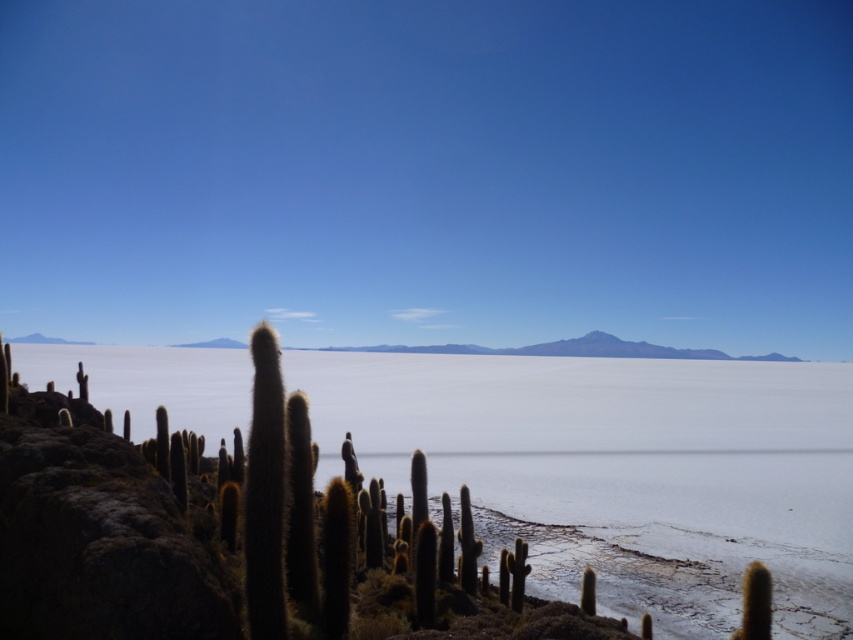
Question: Where is white matte water at center located in relation to white salt flat at center in the image?

Choices:
 (A) above
 (B) below

Answer: (B)

Question: Among these objects, which one is nearest to the camera?

Choices:
 (A) white matte water at center
 (B) white salt flat at center

Answer: (A)

Question: Does white matte water at center have a greater width compared to white salt flat at center?

Choices:
 (A) yes
 (B) no

Answer: (B)

Question: Is white matte water at center closer to camera compared to white salt flat at center?

Choices:
 (A) no
 (B) yes

Answer: (B)